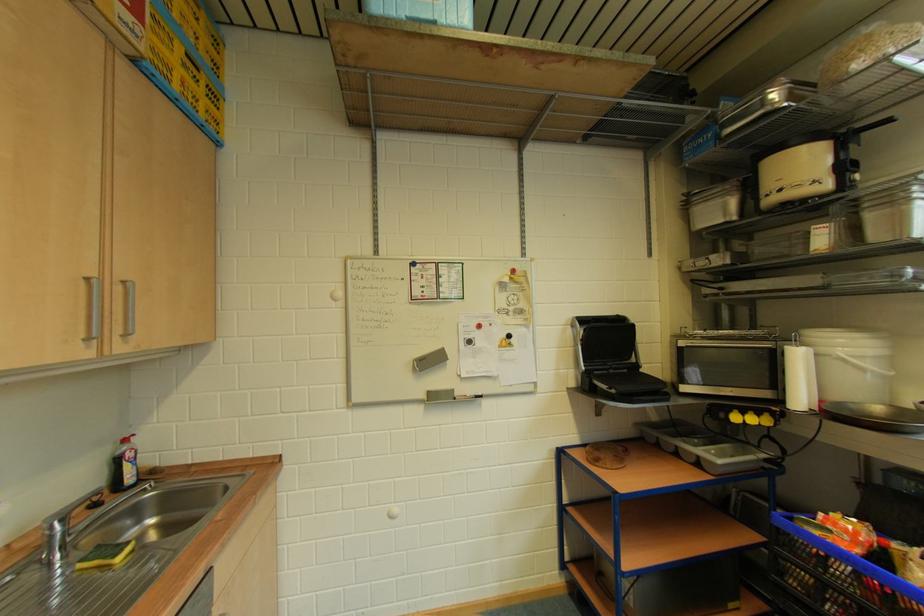
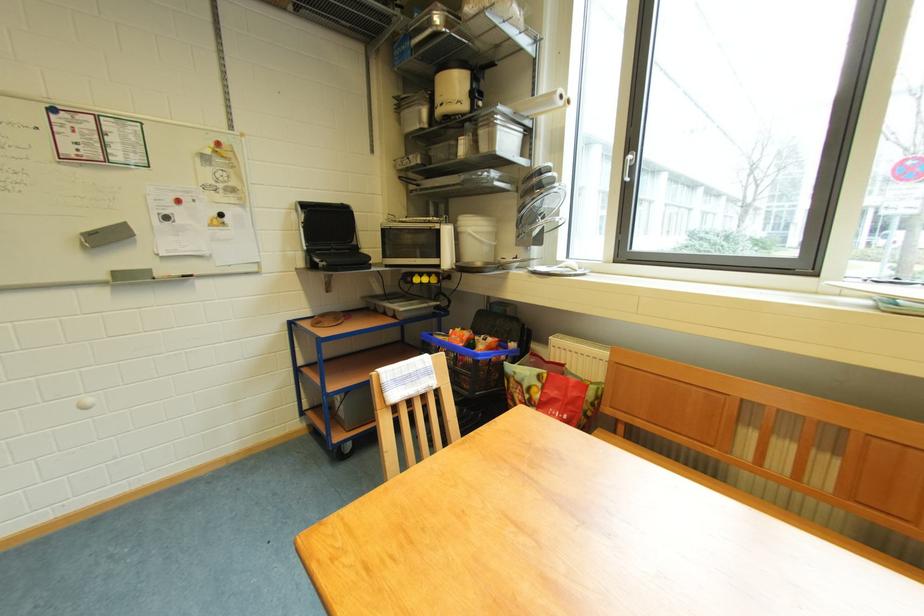
Locate, in the second image, the point that corresponds to (x=858, y=360) in the first image.

(481, 235)